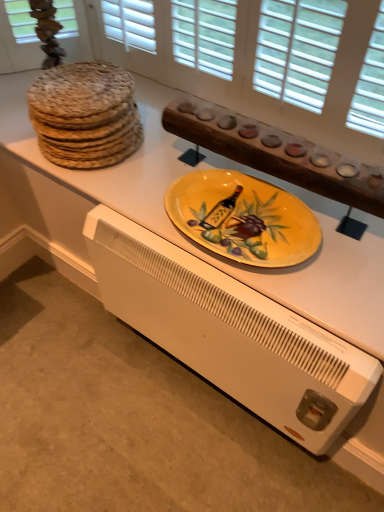
Image resolution: width=384 pixels, height=512 pixels. What do you see at coordinates (243, 218) in the screenshot?
I see `yellow ceramic plate at center` at bounding box center [243, 218].

Identify the location of yellow ceramic plate at center. The height and width of the screenshot is (512, 384). (243, 218).

The width and height of the screenshot is (384, 512). I want to click on yellow ceramic plate at center, so click(243, 218).